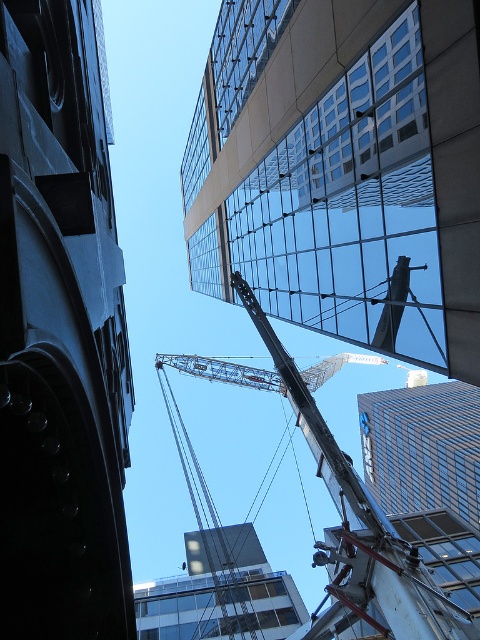
Can you confirm if dark gray stone tower at left is positioned below metallic gray crane at center?

No, dark gray stone tower at left is not below metallic gray crane at center.

Who is more forward, (43,529) or (440,593)?

Point (43,529) is in front.

Between point (13, 435) and point (320, 435), which one is positioned in front?

Point (13, 435)

You are a GUI agent. You are given a task and a screenshot of the screen. Output one action in this format:
    pyautogui.click(x=<x>, y=<y>)
    Task: Click on the dark gray stone tower at left
    
    Given the screenshot: What is the action you would take?
    pyautogui.click(x=60, y=332)

Consider the image. Which is above, glassy reflective building at upper center or metallic gray crane at center?

Positioned higher is glassy reflective building at upper center.

Can you confirm if glassy reflective building at upper center is positioned below metallic gray crane at center?

No.

Which is behind, point (376, 81) or point (376, 554)?

The point (376, 554) is behind.

This screenshot has width=480, height=640. I want to click on glassy reflective building at upper center, so click(344, 172).

Who is shorter, glassy reflective building at upper center or dark gray stone tower at left?

glassy reflective building at upper center is shorter.

Locate an element on the screen. The image size is (480, 640). glassy reflective building at upper center is located at coordinates (344, 172).